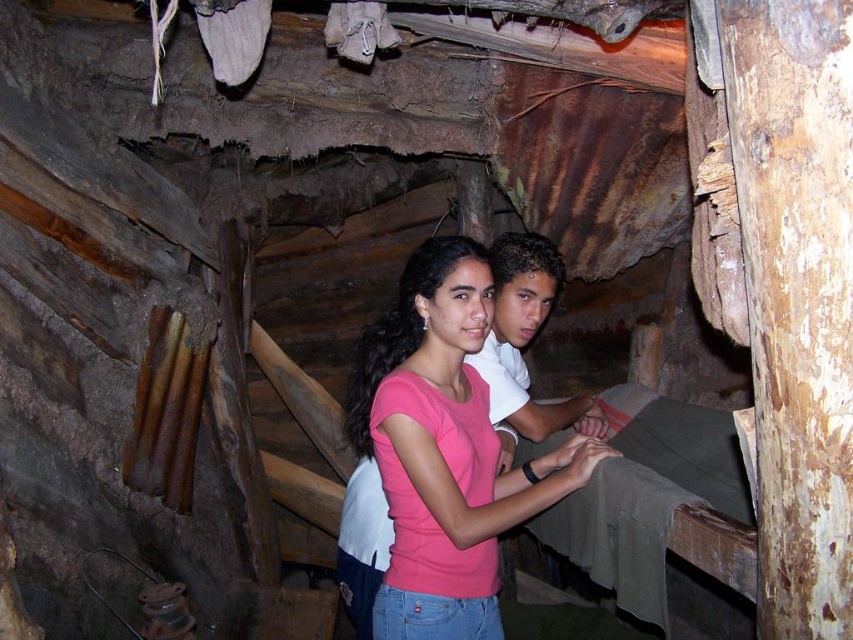
This screenshot has height=640, width=853. What do you see at coordinates (445, 449) in the screenshot?
I see `pink matte shirt at center` at bounding box center [445, 449].

Is pink matte shirt at center smaller than white matte shirt at center?

Actually, pink matte shirt at center might be larger than white matte shirt at center.

Is point (408, 554) positioned before point (549, 250)?

Yes.

At what (x,y) coordinates should I click in order to perform the action: click on pink matte shirt at center. Please return your answer as a coordinate pair (x, y). This screenshot has width=853, height=640. Looking at the image, I should click on (445, 449).